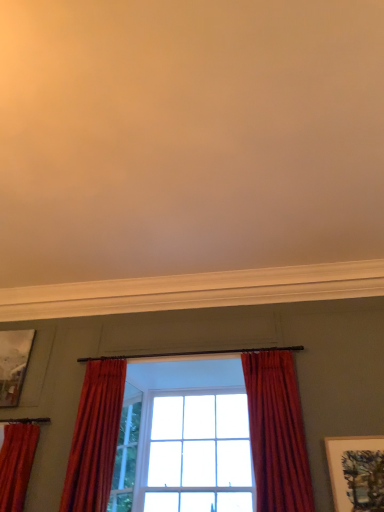
Question: Is velvet red curtain at left, placed as the 3th curtain when sorted from right to left, wider or thinner than velvet red curtain at center, arranged as the third curtain when viewed from the left?

Choices:
 (A) thin
 (B) wide

Answer: (A)

Question: Choose the correct answer: Is velvet red curtain at left, the first curtain from the left, inside velvet red curtain at center, which ranks as the 1th curtain in right-to-left order, or outside it?

Choices:
 (A) outside
 (B) inside

Answer: (A)

Question: Based on their relative distances, which object is nearer to the satin red curtain at center, positioned as the second curtain in right-to-left order?

Choices:
 (A) clear glass window at center
 (B) velvet red curtain at center, which ranks as the 1th curtain in right-to-left order
 (C) matte white picture frame at lower right, arranged as the 1th picture frame when ordered from the bottom
 (D) metallic silver picture frame at upper left, the 2th picture frame from the right
 (E) velvet red curtain at left, placed as the 3th curtain when sorted from right to left

Answer: (E)

Question: Which object is the farthest from the velvet red curtain at left, placed as the 3th curtain when sorted from right to left?

Choices:
 (A) metallic silver picture frame at upper left, which is the 1th picture frame from back to front
 (B) velvet red curtain at center, which ranks as the 1th curtain in right-to-left order
 (C) clear glass window at center
 (D) matte white picture frame at lower right, arranged as the 1th picture frame when ordered from the bottom
 (E) clear glass door at center

Answer: (D)